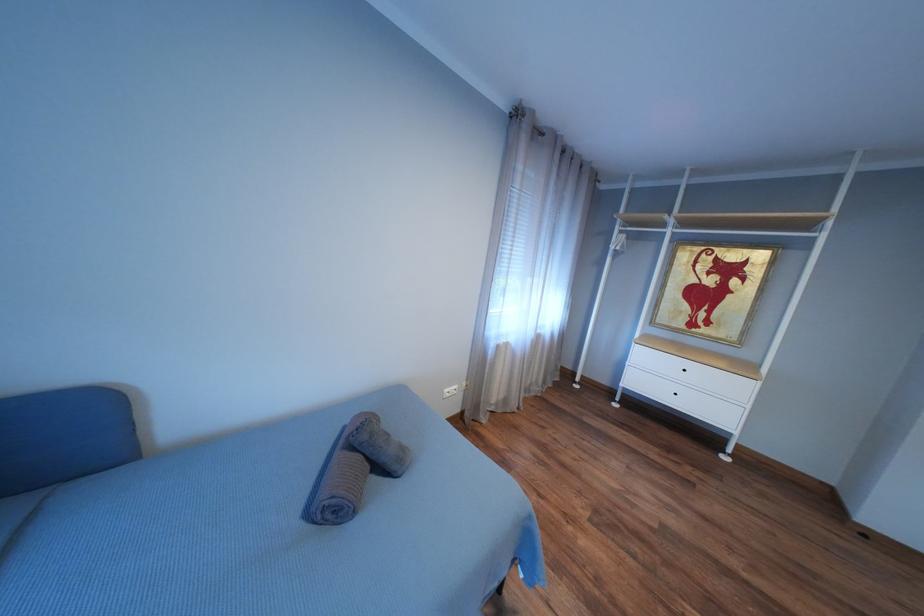
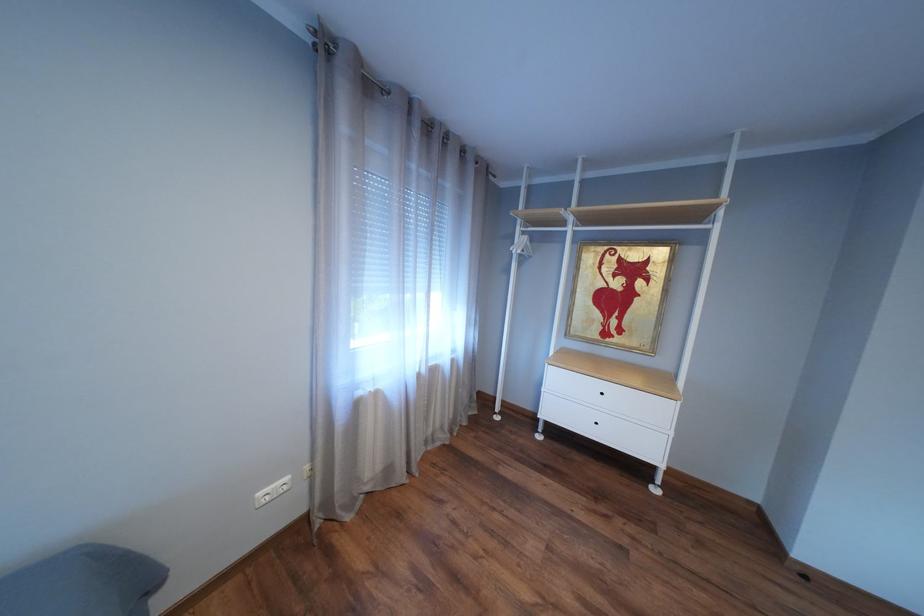
Question: The camera is either moving clockwise (left) or counter-clockwise (right) around the object. The first image is from the beginning of the video and the second image is from the end. Is the camera moving left or right when shooting the video?

Choices:
 (A) Left
 (B) Right

Answer: (A)